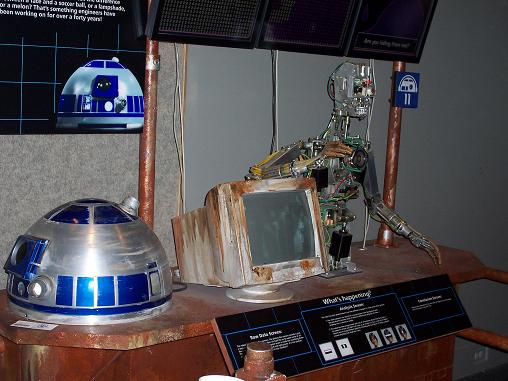
You are a GUI agent. You are given a task and a screenshot of the screen. Output one action in this format:
    pyautogui.click(x=<x>, y=<y>)
    Task: Click on the lights
    
    Given the screenshot: What is the action you would take?
    pyautogui.click(x=228, y=22)